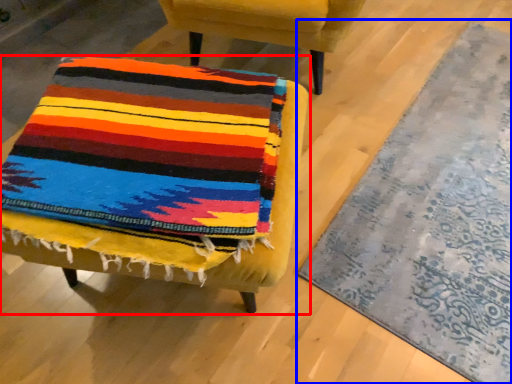
Question: Which of the following is the farthest to the observer, chair (highlighted by a red box) or mat (highlighted by a blue box)?

Choices:
 (A) chair
 (B) mat

Answer: (B)